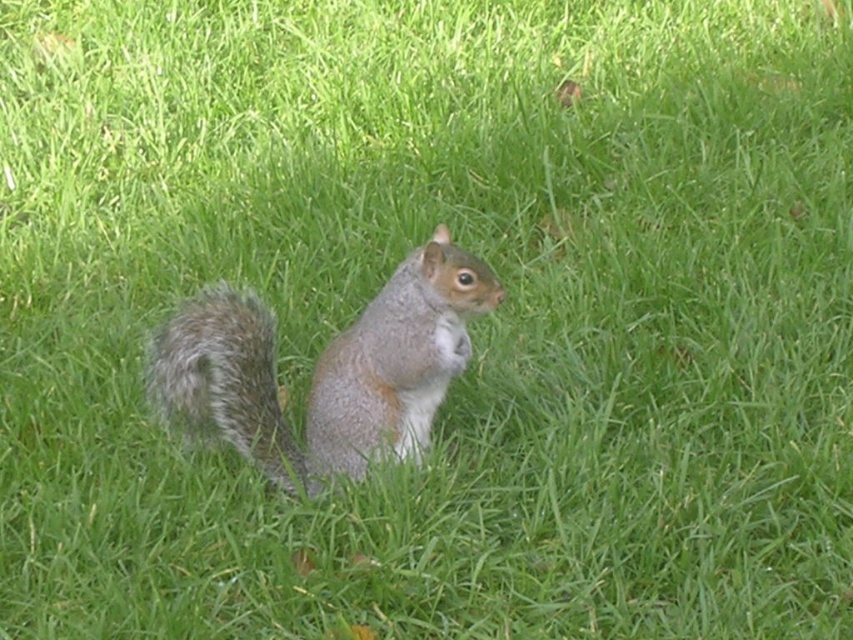
Question: Does gray furry squirrel at center appear over fuzzy gray tail at center?

Choices:
 (A) yes
 (B) no

Answer: (A)

Question: Which point is closer to the camera?

Choices:
 (A) (273, 349)
 (B) (250, 365)

Answer: (B)

Question: Can you confirm if gray furry squirrel at center is positioned to the left of fuzzy gray tail at center?

Choices:
 (A) yes
 (B) no

Answer: (B)

Question: Considering the relative positions of gray furry squirrel at center and fuzzy gray tail at center in the image provided, where is gray furry squirrel at center located with respect to fuzzy gray tail at center?

Choices:
 (A) right
 (B) left

Answer: (A)